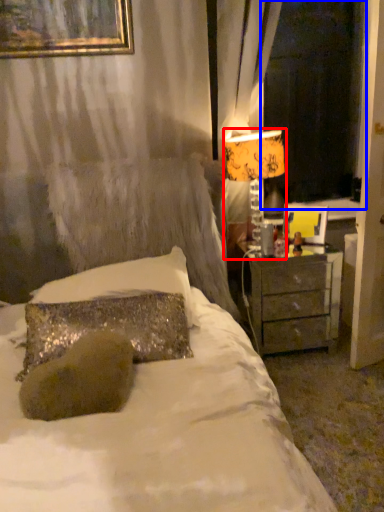
Question: Which object appears closest to the camera in this image, table lamp (highlighted by a red box) or window screen (highlighted by a blue box)?

Choices:
 (A) table lamp
 (B) window screen

Answer: (A)